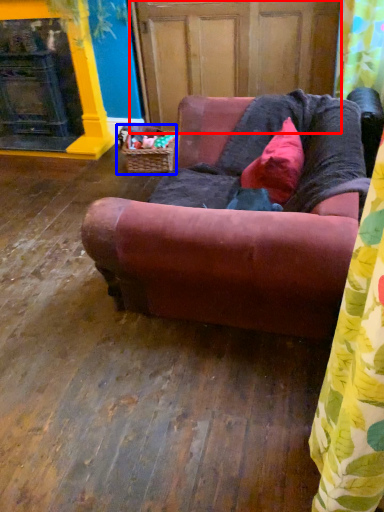
Question: Which point is further to the camera, screen door (highlighted by a red box) or basket (highlighted by a blue box)?

Choices:
 (A) screen door
 (B) basket

Answer: (B)